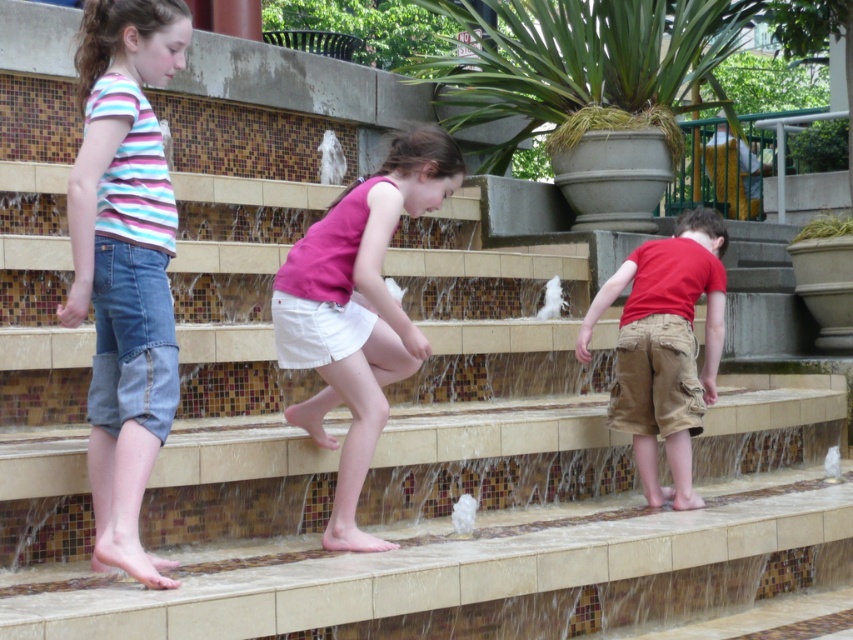
Question: Is denim shorts at left positioned at the back of pink fabric shorts at center?

Choices:
 (A) yes
 (B) no

Answer: (B)

Question: Which point appears closest to the camera in this image?

Choices:
 (A) tap(323, 241)
 (B) tap(637, 310)
 (C) tap(166, 81)

Answer: (C)

Question: Can you confirm if denim shorts at left is smaller than pink fabric shorts at center?

Choices:
 (A) no
 (B) yes

Answer: (B)

Question: Which point is closer to the camera?

Choices:
 (A) (680, 294)
 (B) (88, 264)
 (C) (431, 166)

Answer: (B)

Question: Estimate the real-world distances between objects in this image. Which object is farther from the pink fabric shorts at center?

Choices:
 (A) red cotton shirt at lower right
 (B) denim shorts at left

Answer: (A)

Question: Does denim shorts at left have a lesser width compared to pink fabric shorts at center?

Choices:
 (A) yes
 (B) no

Answer: (A)